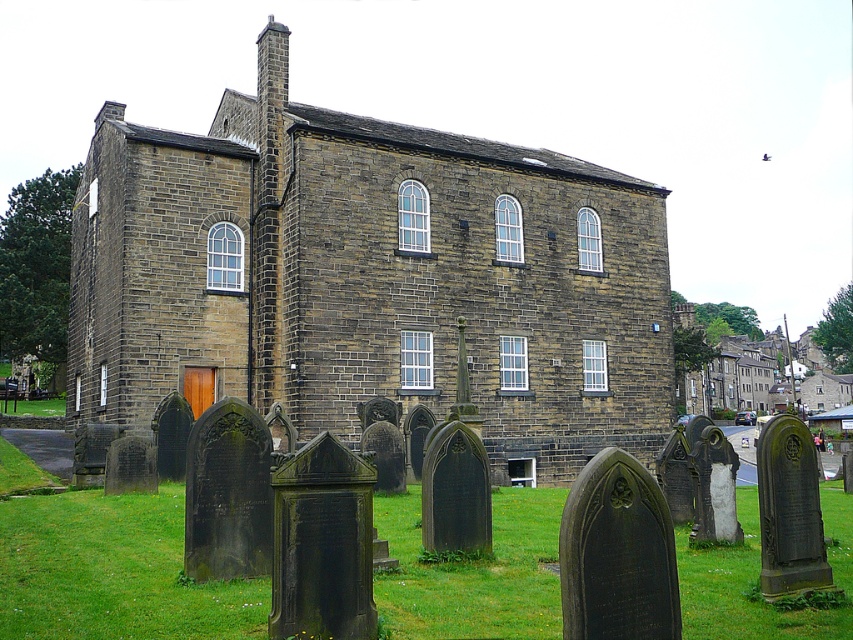
Is point (172, 291) positioned in front of point (149, 573)?

That is False.

Is brown stone church at center closer to camera compared to green grass at lower center?

That is False.

Where is `brown stone church at center`? The image size is (853, 640). brown stone church at center is located at coordinates (368, 278).

Where is `brown stone church at center`? This screenshot has width=853, height=640. brown stone church at center is located at coordinates (x=368, y=278).